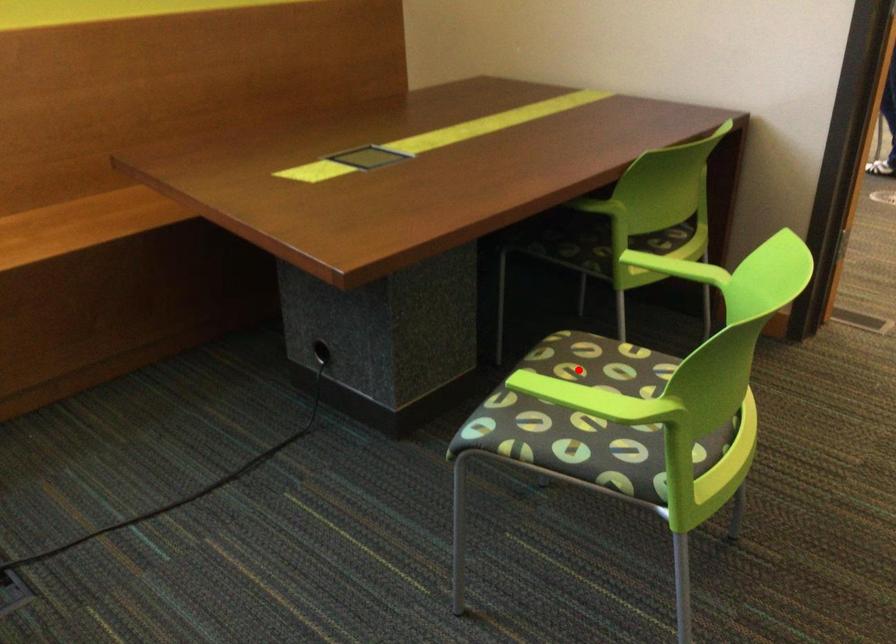
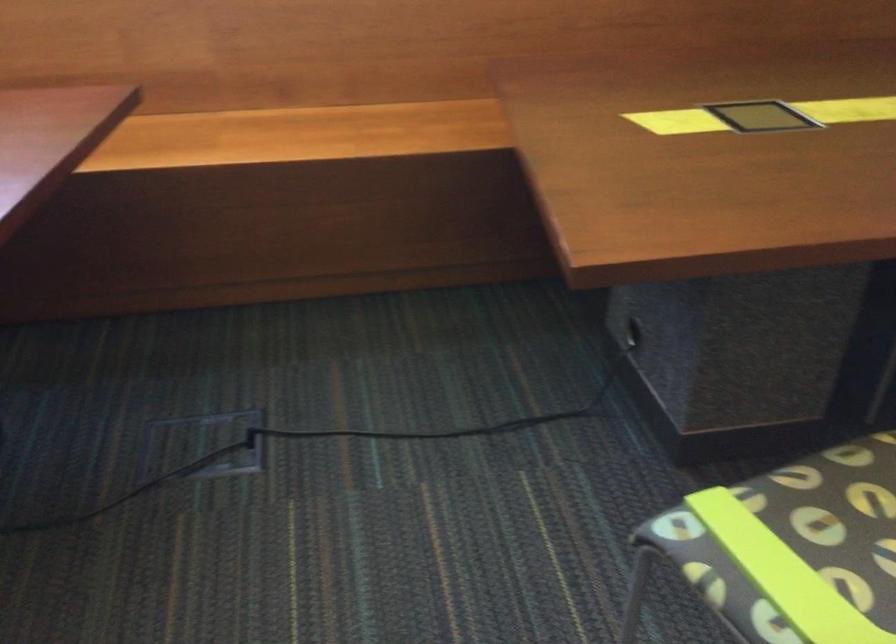
Locate, in the second image, the point that corresponds to the highlighted location in the first image.

(871, 496)